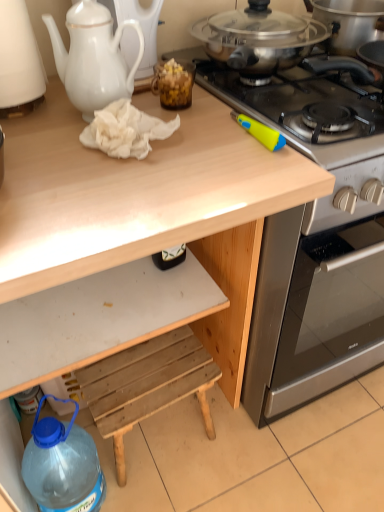
Locate an element on the screen. free space in front of white ceramic teapot at upper left is located at coordinates (37, 142).